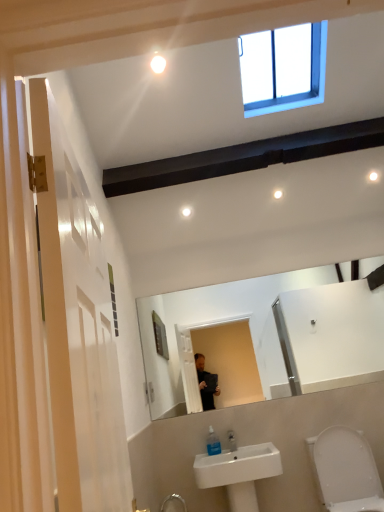
Question: Would you say white glossy toilet at lower right contains clear plastic soap dispenser at lower center?

Choices:
 (A) yes
 (B) no

Answer: (B)

Question: From the image's perspective, is white glossy toilet at lower right below clear plastic soap dispenser at lower center?

Choices:
 (A) no
 (B) yes

Answer: (B)

Question: Is white glossy toilet at lower right to the right of clear plastic soap dispenser at lower center from the viewer's perspective?

Choices:
 (A) yes
 (B) no

Answer: (A)

Question: Is white glossy toilet at lower right bigger than clear plastic soap dispenser at lower center?

Choices:
 (A) no
 (B) yes

Answer: (B)

Question: Is white glossy toilet at lower right completely or partially outside of clear plastic soap dispenser at lower center?

Choices:
 (A) no
 (B) yes

Answer: (B)

Question: From a real-world perspective, is white glossy toilet at lower right under clear plastic soap dispenser at lower center?

Choices:
 (A) no
 (B) yes

Answer: (B)

Question: Are clear plastic soap dispenser at lower center and white ceramic sink at lower center far apart?

Choices:
 (A) no
 (B) yes

Answer: (A)

Question: Considering the relative sizes of clear plastic soap dispenser at lower center and white ceramic sink at lower center in the image provided, is clear plastic soap dispenser at lower center shorter than white ceramic sink at lower center?

Choices:
 (A) yes
 (B) no

Answer: (A)

Question: Is clear plastic soap dispenser at lower center taller than white ceramic sink at lower center?

Choices:
 (A) yes
 (B) no

Answer: (B)

Question: Can you confirm if clear plastic soap dispenser at lower center is positioned to the left of white ceramic sink at lower center?

Choices:
 (A) yes
 (B) no

Answer: (A)

Question: Is clear plastic soap dispenser at lower center not within white ceramic sink at lower center?

Choices:
 (A) no
 (B) yes

Answer: (A)

Question: Can you confirm if clear plastic soap dispenser at lower center is bigger than white ceramic sink at lower center?

Choices:
 (A) yes
 (B) no

Answer: (B)

Question: Can you confirm if clear plastic soap dispenser at lower center is thinner than white glossy light bulb at upper center?

Choices:
 (A) no
 (B) yes

Answer: (B)